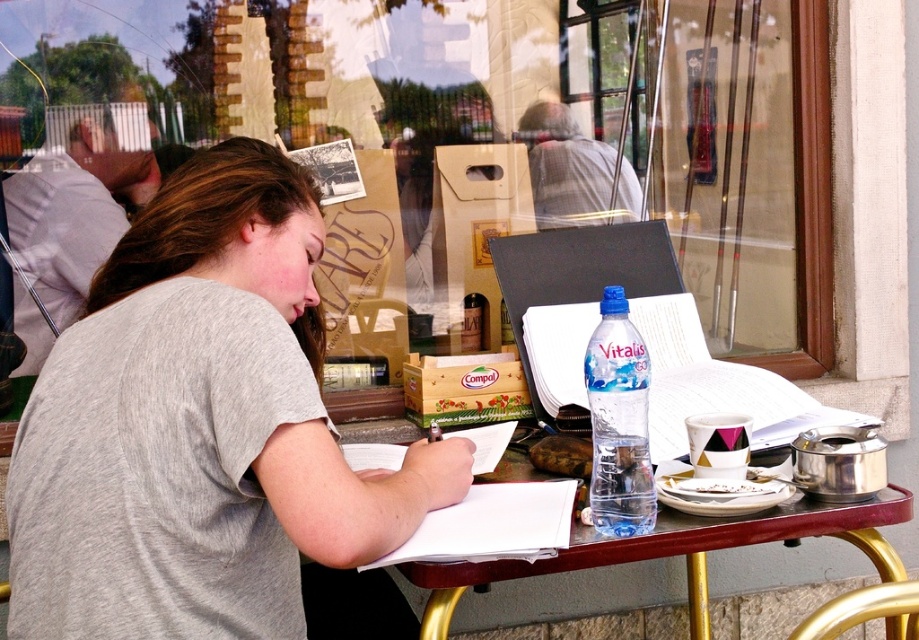
Is gray cotton shirt at center to the left of wooden table at center from the viewer's perspective?

Correct, you'll find gray cotton shirt at center to the left of wooden table at center.

Is point (296, 612) behind point (704, 564)?

No, (296, 612) is closer to viewer.

Which is behind, point (263, 403) or point (791, 516)?

Positioned behind is point (791, 516).

This screenshot has width=919, height=640. What are the coordinates of `gray cotton shirt at center` in the screenshot? It's located at (201, 429).

Can you confirm if wooden table at center is positioned to the right of clear plastic bottle at center?

Yes, wooden table at center is to the right of clear plastic bottle at center.

Is point (877, 522) farther from viewer compared to point (621, 502)?

Yes, point (877, 522) is farther from viewer.

Identify the location of wooden table at center. (657, 545).

Who is lower down, gray cotton shirt at center or clear plastic bottle at center?

clear plastic bottle at center is below.

Who is higher up, gray cotton shirt at center or clear plastic bottle at center?

gray cotton shirt at center

Is point (221, 392) farther from camera compared to point (609, 328)?

No, it is not.

Locate an element on the screen. gray cotton shirt at center is located at coordinates (201, 429).